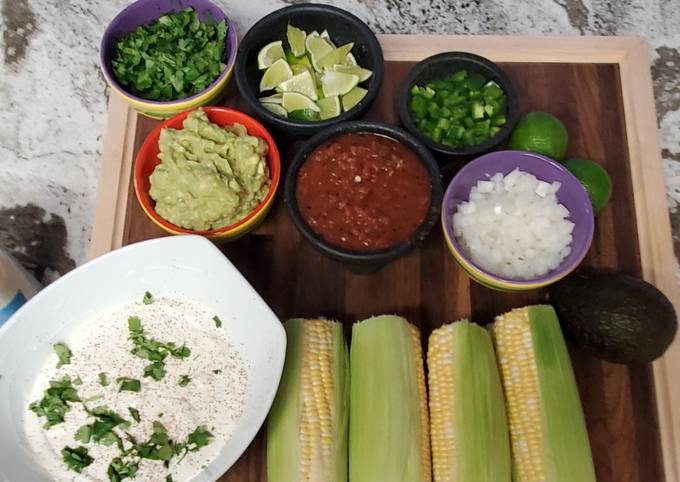
Find the location of a particular element. This screenshot has height=482, width=680. bowl is located at coordinates (205, 92), (254, 101), (258, 127), (318, 138), (404, 103), (462, 179), (241, 312).